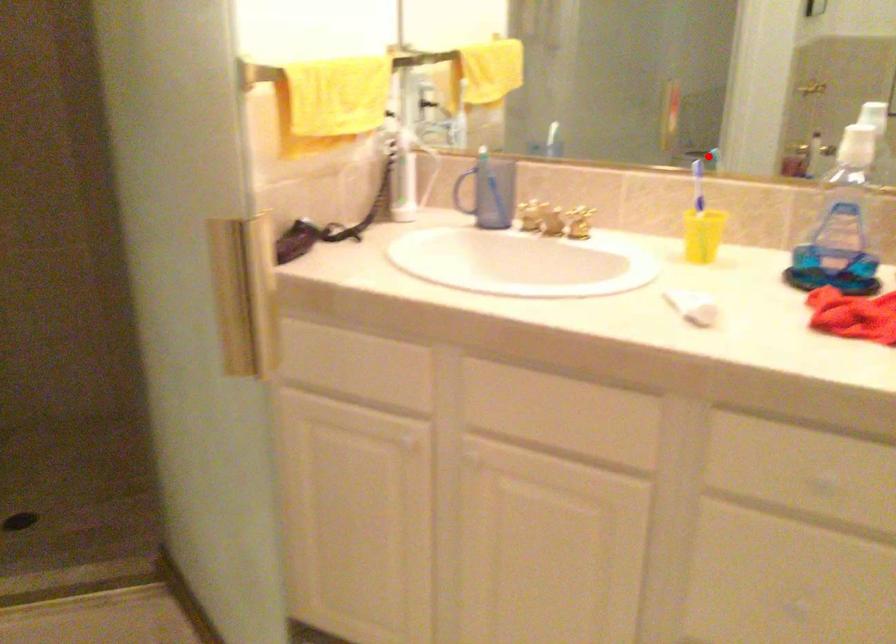
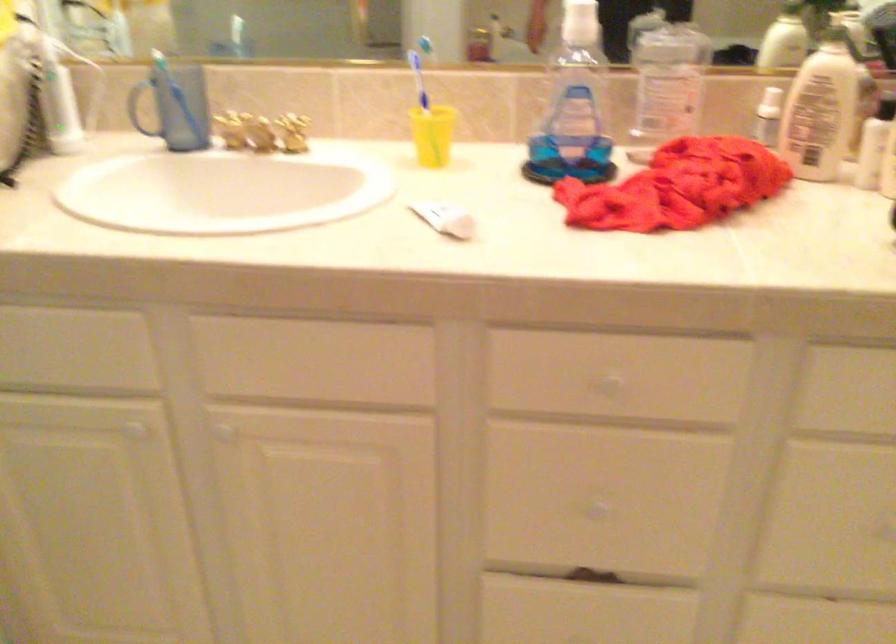
Question: I am providing you with two images of the same scene from different viewpoints. Given a red point in image1, look at the same physical point in image2. Is it:

Choices:
 (A) Closer to the viewpoint
 (B) Farther from the viewpoint

Answer: (A)